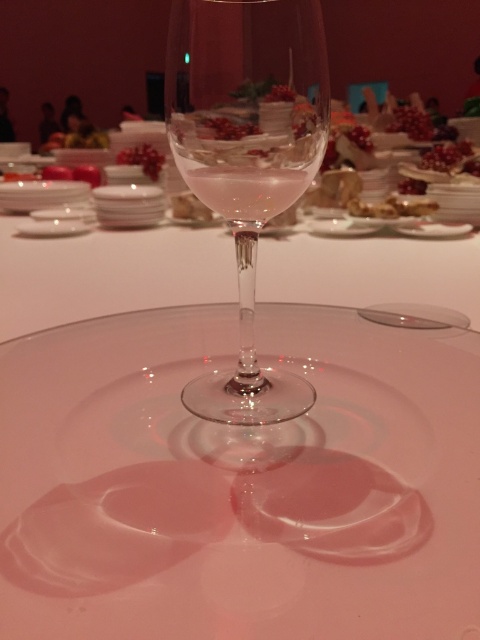
You are a server at a formal event and need to place the transparent glass wine glass at center on top of the matte gold plate at upper center. Based on their sizes, do you think the wine glass will fit securely on the plate?

The transparent glass wine glass at center is much taller than the matte gold plate at upper center, so the wine glass will likely extend above the plate but should still fit securely as long as its base is within the plate.

You are standing at a distance and want to place a 10 inch long decorative item on the transparent glass plate at center. Can you reach the plate to place the item without moving closer?

The distance between the transparent glass plate at center and the viewer is 9.06 inches. Since the decorative item is 10 inches long, it is longer than the distance to the plate. Therefore, you cannot safely place the item without moving closer to ensure it reaches the plate.

You are a guest at a formal dinner and notice the clear glass wine at center and the pink glossy berries at upper center on the table. Which object is closer to you from your seated position?

The clear glass wine at center is closer to you because it is in front of the pink glossy berries at upper center.